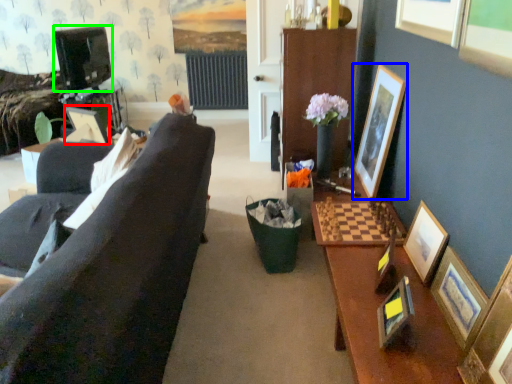
Question: Estimate the real-world distances between objects in this image. Which object is closer to picture frame (highlighted by a red box), picture frame (highlighted by a blue box) or television (highlighted by a green box)?

Choices:
 (A) picture frame
 (B) television

Answer: (A)